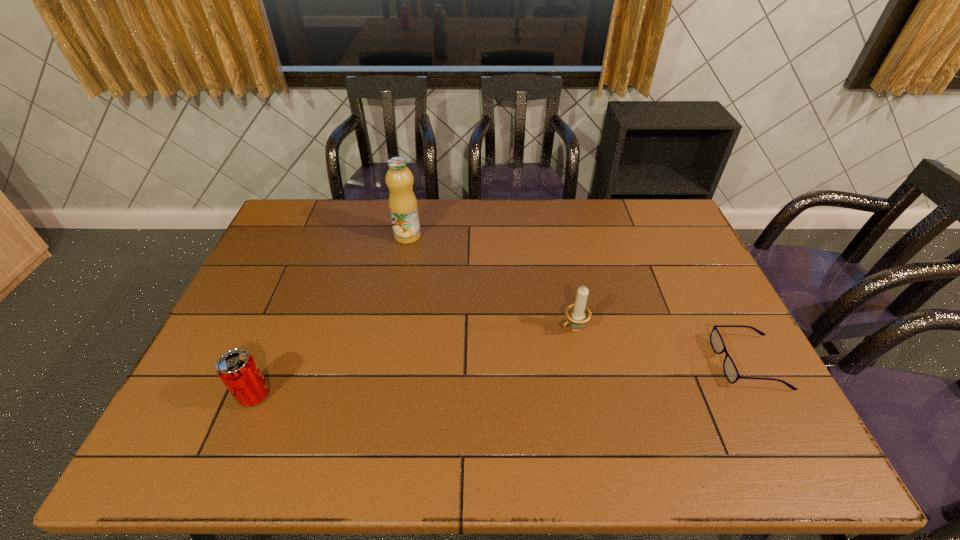
You are a GUI agent. You are given a task and a screenshot of the screen. Output one action in this format:
    pyautogui.click(x=<x>, y=<y>)
    Task: Click on the vacant region located on the front label of the farthest object
    The width and height of the screenshot is (960, 540).
    Given the screenshot: What is the action you would take?
    pyautogui.click(x=456, y=275)

Where is `vacant space located on the front label of the farthest object`? vacant space located on the front label of the farthest object is located at coordinates (454, 274).

Where is `vacant position located 0.110m on the front label of the farthest object`? vacant position located 0.110m on the front label of the farthest object is located at coordinates (435, 258).

Where is `vacant space situated 0.230m on the handle side of the second object from right to left`? This screenshot has width=960, height=540. vacant space situated 0.230m on the handle side of the second object from right to left is located at coordinates (501, 378).

I want to click on free spot located 0.220m on the handle side of the second object from right to left, so click(504, 376).

Locate an element on the screen. This screenshot has width=960, height=540. vacant space located on the handle side of the second object from right to left is located at coordinates (486, 389).

At what (x,y) coordinates should I click in order to perform the action: click on object that is at the far edge. Please return your answer as a coordinate pair (x, y). The image size is (960, 540). Looking at the image, I should click on (403, 207).

Find the location of a particular element. The width and height of the screenshot is (960, 540). soda can that is at the near edge is located at coordinates (237, 369).

Identify the location of spectacles that is positioned at the near edge. This screenshot has width=960, height=540. pyautogui.click(x=729, y=367).

Identify the location of object that is at the left edge. This screenshot has width=960, height=540. (237, 369).